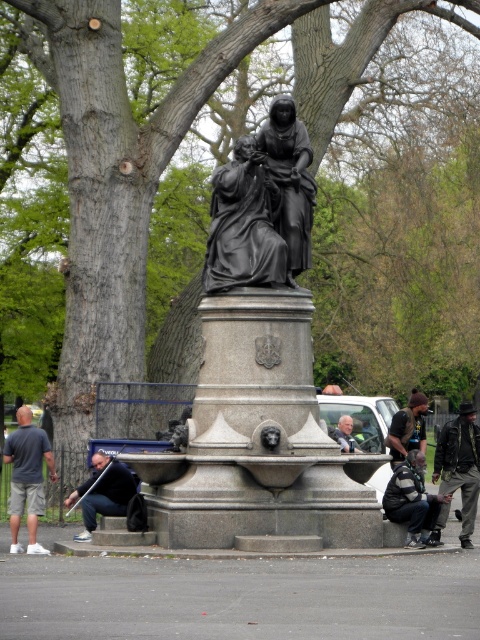
Can you confirm if leather jacket at lower right is wider than light brown leather jacket at center?

Yes, leather jacket at lower right is wider than light brown leather jacket at center.

Does leather jacket at lower right appear under light brown leather jacket at center?

Yes.

Between point (446, 504) and point (348, 428), which one is positioned behind?

The point (348, 428) is more distant.

Identify the location of leather jacket at lower right. The image size is (480, 640). (459, 465).

Does polished bronze statue at center come behind light brown leather jacket at center?

No, it is not.

Is polished bronze statue at center smaller than light brown leather jacket at center?

Incorrect, polished bronze statue at center is not smaller in size than light brown leather jacket at center.

At what (x,y) coordinates should I click in order to perform the action: click on polished bronze statue at center. Please return your answer as a coordinate pair (x, y). This screenshot has width=480, height=640. Looking at the image, I should click on (254, 390).

Between point (420, 536) and point (111, 472), which one is positioned behind?

The point (111, 472) is more distant.

Does dark gray leather jacket at lower right have a lesser height compared to dark blue jeans at lower left?

Indeed, dark gray leather jacket at lower right has a lesser height compared to dark blue jeans at lower left.

Does point (429, 518) lie in front of point (71, 492)?

Yes, point (429, 518) is in front of point (71, 492).

Identify the location of dark gray leather jacket at lower right. This screenshot has width=480, height=640. (411, 499).